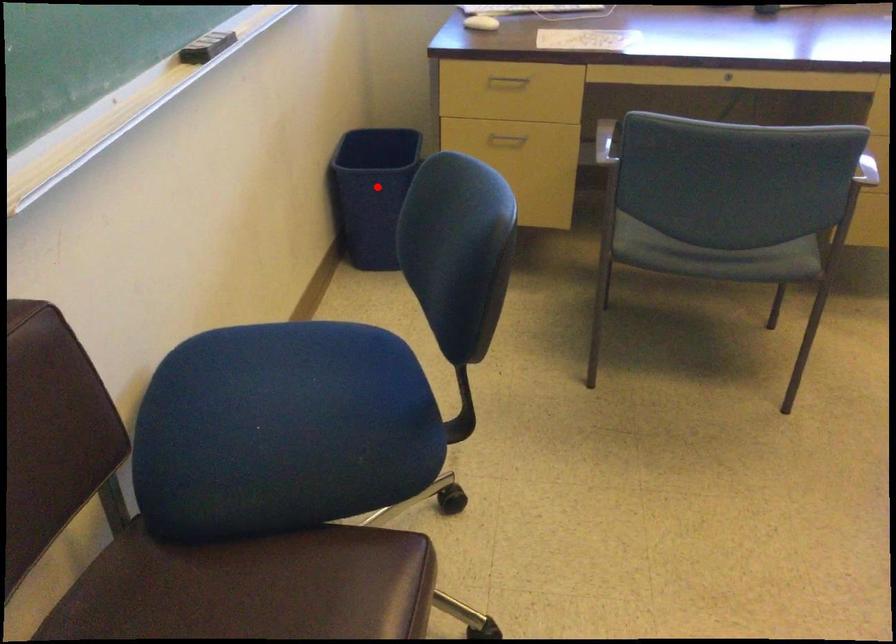
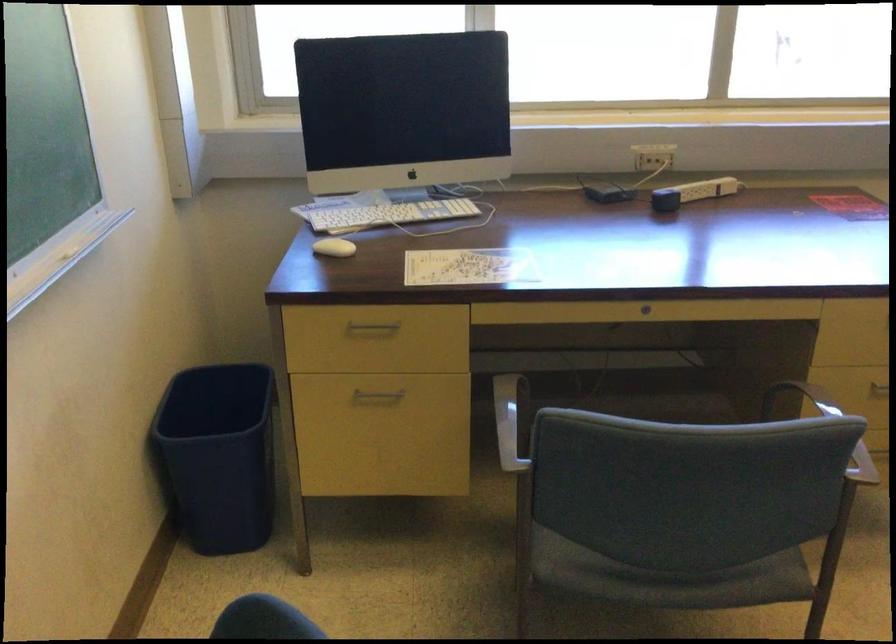
The point at the highlighted location is marked in the first image. Where is the corresponding point in the second image?

(217, 456)